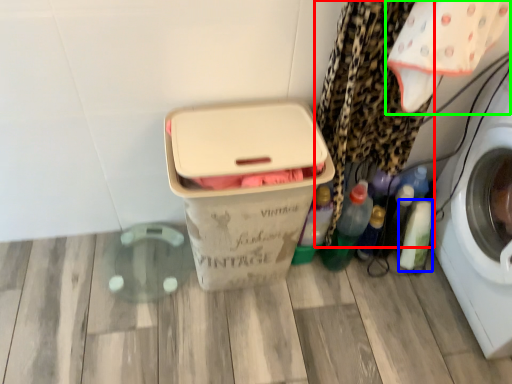
Question: Estimate the real-world distances between objects in this image. Which object is closer to curtain (highlighted by a red box), bottle (highlighted by a blue box) or baby clothe (highlighted by a green box)?

Choices:
 (A) bottle
 (B) baby clothe

Answer: (B)